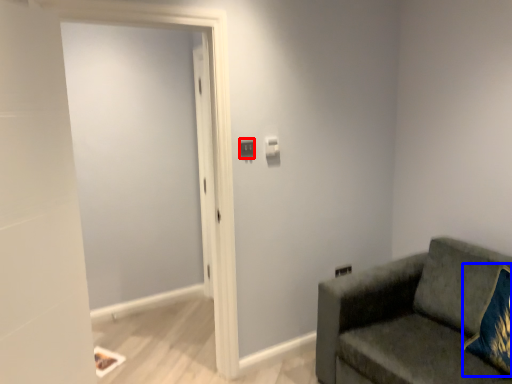
Question: Among these objects, which one is farthest to the camera, light switch (highlighted by a red box) or throw pillow (highlighted by a blue box)?

Choices:
 (A) light switch
 (B) throw pillow

Answer: (A)